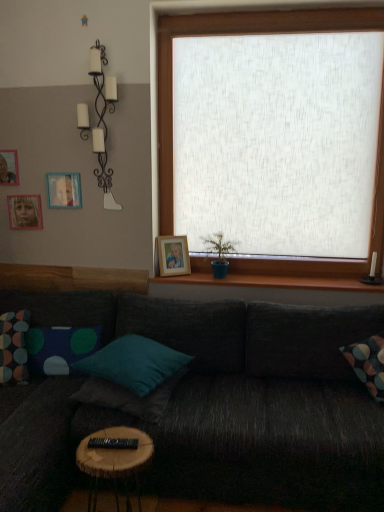
Question: Is wooden picture frame at upper left, marked as the 2th picture frame in a top-to-bottom arrangement, next to wooden round table at lower center?

Choices:
 (A) yes
 (B) no

Answer: (B)

Question: Is wooden picture frame at upper left, which is the third picture frame from left to right, far from wooden round table at lower center?

Choices:
 (A) no
 (B) yes

Answer: (B)

Question: Is wooden picture frame at upper left, marked as the 2th picture frame in a top-to-bottom arrangement, smaller than wooden round table at lower center?

Choices:
 (A) no
 (B) yes

Answer: (B)

Question: Considering the relative sizes of wooden picture frame at upper left, marked as the 2th picture frame in a top-to-bottom arrangement, and wooden round table at lower center in the image provided, is wooden picture frame at upper left, marked as the 2th picture frame in a top-to-bottom arrangement, taller than wooden round table at lower center?

Choices:
 (A) no
 (B) yes

Answer: (A)

Question: From the image's perspective, is wooden picture frame at upper left, which is the third picture frame from left to right, on wooden round table at lower center?

Choices:
 (A) yes
 (B) no

Answer: (A)

Question: From a real-world perspective, is wooden picture frame at upper left, which is the 2th picture frame in right-to-left order, beneath wooden round table at lower center?

Choices:
 (A) no
 (B) yes

Answer: (A)

Question: Is matte wooden picture frame at upper left, which ranks as the third picture frame in right-to-left order, positioned behind dark gray fabric couch at center?

Choices:
 (A) no
 (B) yes

Answer: (B)

Question: Is matte wooden picture frame at upper left, the 2th picture frame viewed from the left, positioned far away from dark gray fabric couch at center?

Choices:
 (A) no
 (B) yes

Answer: (B)

Question: Is matte wooden picture frame at upper left, which is counted as the 3th picture frame, starting from the top, next to dark gray fabric couch at center and touching it?

Choices:
 (A) yes
 (B) no

Answer: (B)

Question: Is matte wooden picture frame at upper left, the second picture frame in the bottom-to-top sequence, positioned with its back to dark gray fabric couch at center?

Choices:
 (A) no
 (B) yes

Answer: (A)

Question: From a real-world perspective, is matte wooden picture frame at upper left, the 2th picture frame viewed from the left, on top of dark gray fabric couch at center?

Choices:
 (A) yes
 (B) no

Answer: (A)

Question: Does matte wooden picture frame at upper left, the second picture frame in the bottom-to-top sequence, have a greater height compared to dark gray fabric couch at center?

Choices:
 (A) no
 (B) yes

Answer: (A)

Question: Does teal fabric pillow at center, the third pillow from the left, lie behind wooden round table at lower center?

Choices:
 (A) yes
 (B) no

Answer: (A)